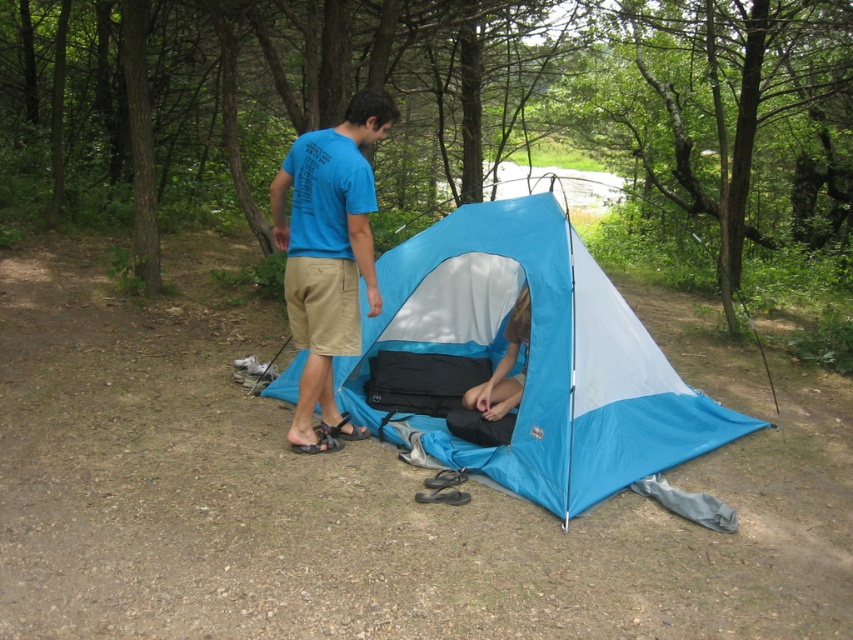
Question: Is blue cotton t-shirt at center bigger than blue fabric tent at center?

Choices:
 (A) no
 (B) yes

Answer: (B)

Question: Is blue tarpaulin tent at center bigger than blue cotton t-shirt at center?

Choices:
 (A) no
 (B) yes

Answer: (B)

Question: Is blue tarpaulin tent at center below blue fabric tent at center?

Choices:
 (A) yes
 (B) no

Answer: (B)

Question: Which point appears farthest from the camera in this image?

Choices:
 (A) (347, 246)
 (B) (693, 426)
 (C) (506, 376)

Answer: (C)

Question: Which object appears closest to the camera in this image?

Choices:
 (A) blue tarpaulin tent at center
 (B) blue cotton t-shirt at center

Answer: (A)

Question: Considering the real-world distances, which object is closest to the blue fabric tent at center?

Choices:
 (A) blue tarpaulin tent at center
 (B) blue cotton t-shirt at center

Answer: (A)